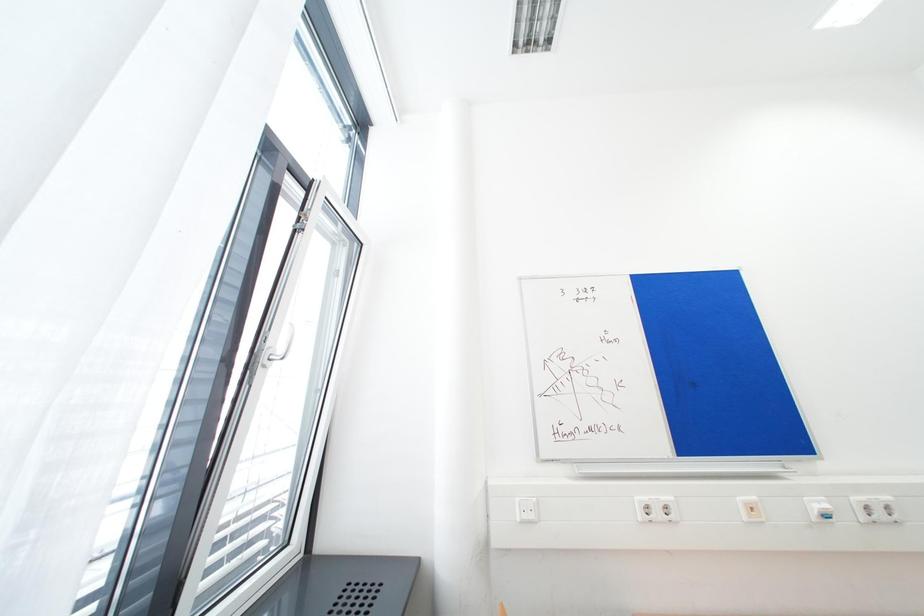
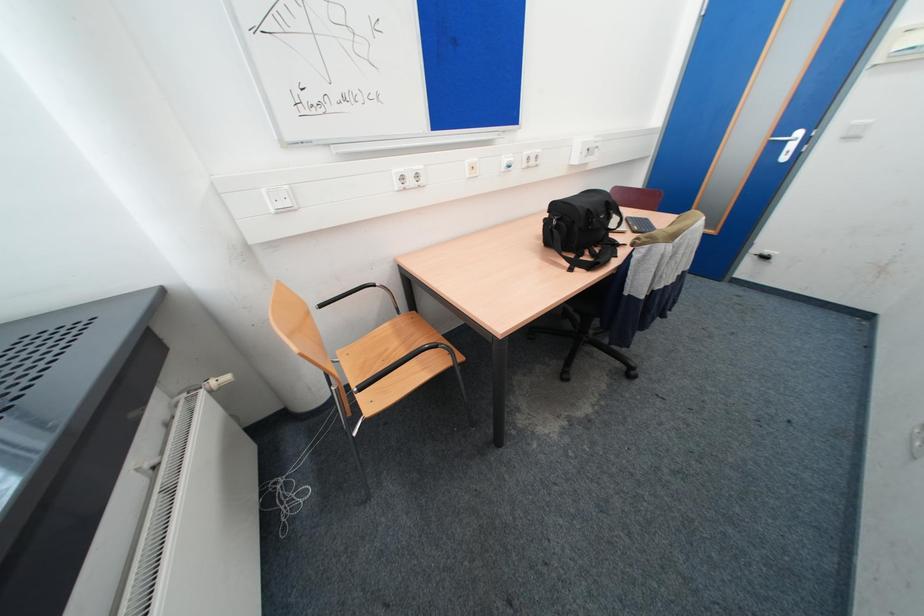
Based on the continuous images, in which direction is the camera rotating?

The camera's rotation is toward right-down.